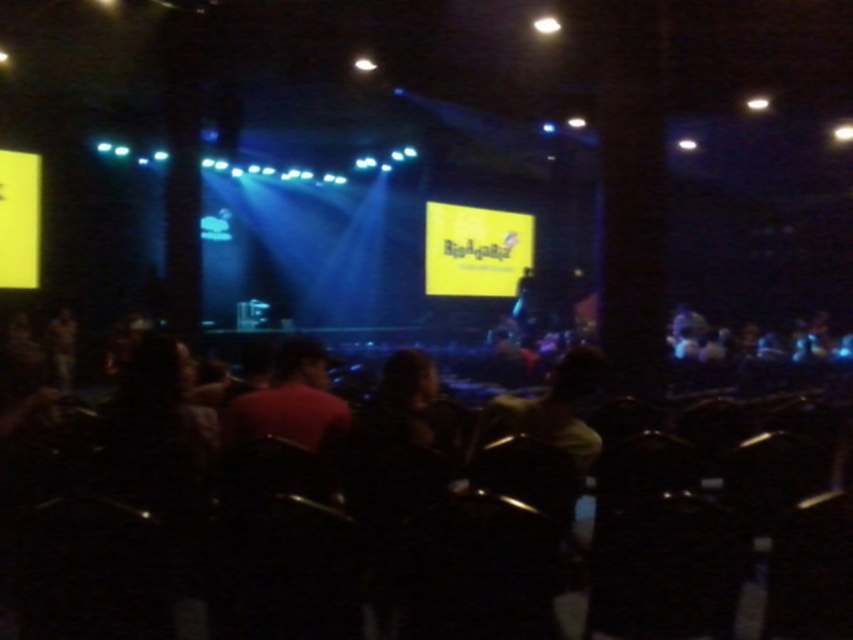
What do you see at coordinates (416, 516) in the screenshot? I see `black plastic chairs at lower center` at bounding box center [416, 516].

Who is positioned more to the left, black plastic chairs at lower center or yellow matte screen at center?

black plastic chairs at lower center is more to the left.

Who is more distant from viewer, (x=492, y=532) or (x=491, y=243)?

The point (x=491, y=243) is behind.

At what (x,y) coordinates should I click in order to perform the action: click on black plastic chairs at lower center. Please return your answer as a coordinate pair (x, y). Image resolution: width=853 pixels, height=640 pixels. Looking at the image, I should click on pyautogui.click(x=416, y=516).